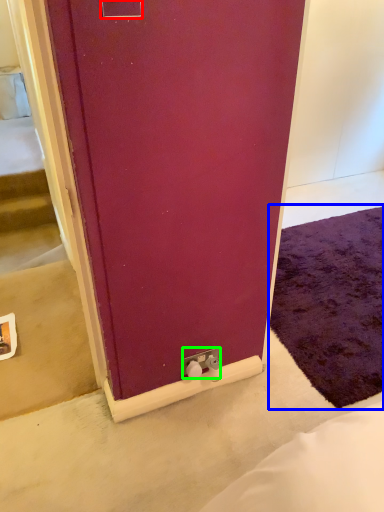
Question: Estimate the real-world distances between objects in this image. Which object is closer to electric outlet (highlighted by a red box), doormat (highlighted by a blue box) or electric outlet (highlighted by a green box)?

Choices:
 (A) doormat
 (B) electric outlet

Answer: (B)